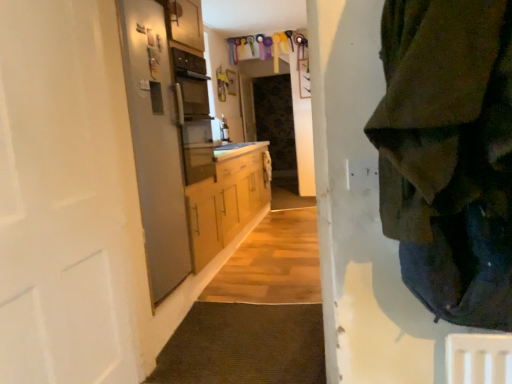
Question: Do you think satin silver refrigerator at left is within white matte door at left, or outside of it?

Choices:
 (A) inside
 (B) outside

Answer: (B)

Question: Based on their sizes in the image, would you say satin silver refrigerator at left is bigger or smaller than white matte door at left?

Choices:
 (A) big
 (B) small

Answer: (B)

Question: Considering the real-world distances, which object is closest to the white matte door at left?

Choices:
 (A) dark green fabric at right
 (B) satin silver refrigerator at left

Answer: (B)

Question: Which object is positioned closest to the dark green fabric at right?

Choices:
 (A) white matte door at left
 (B) satin silver refrigerator at left

Answer: (A)